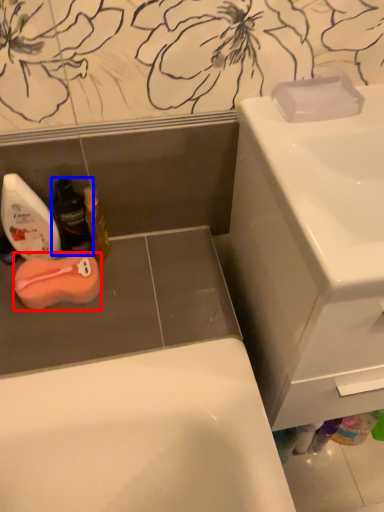
Question: Which point is further to the camera, soap (highlighted by a red box) or mouthwash (highlighted by a blue box)?

Choices:
 (A) soap
 (B) mouthwash

Answer: (A)